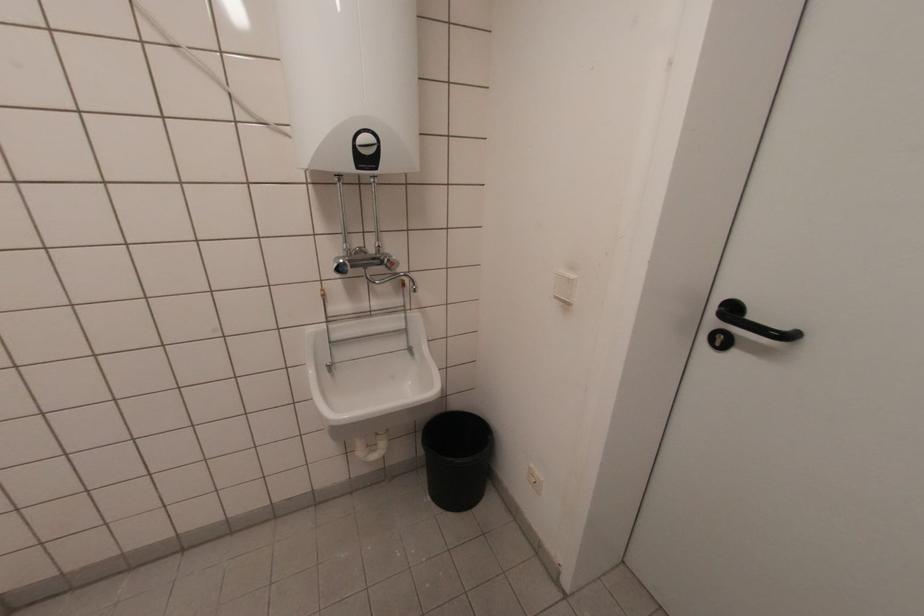
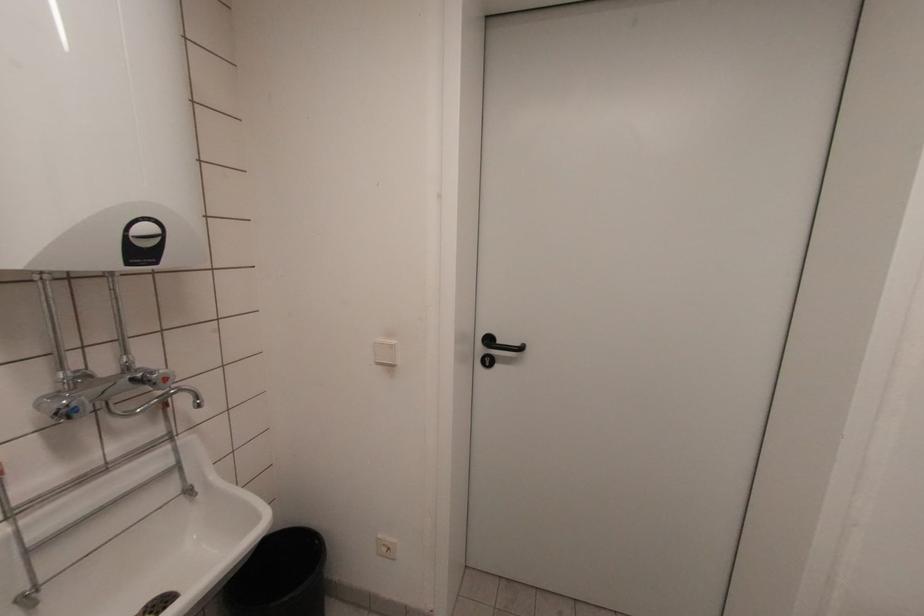
In the second image, find the point that corresponds to [554,288] in the first image.

(375, 355)